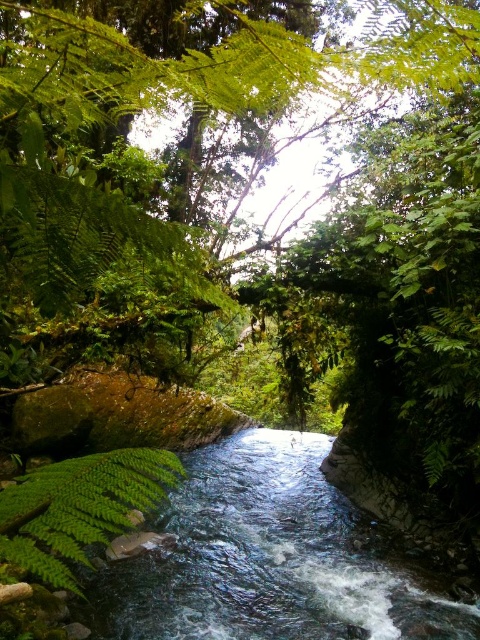
Looking at this image, can you confirm if clear water stream at center is positioned to the right of green leafy fern at center?

Yes, clear water stream at center is to the right of green leafy fern at center.

Who is more forward, (252, 595) or (40, 488)?

Positioned in front is point (40, 488).

The width and height of the screenshot is (480, 640). I want to click on clear water stream at center, so click(269, 557).

Image resolution: width=480 pixels, height=640 pixels. Find the location of `clear water stream at center`. clear water stream at center is located at coordinates (269, 557).